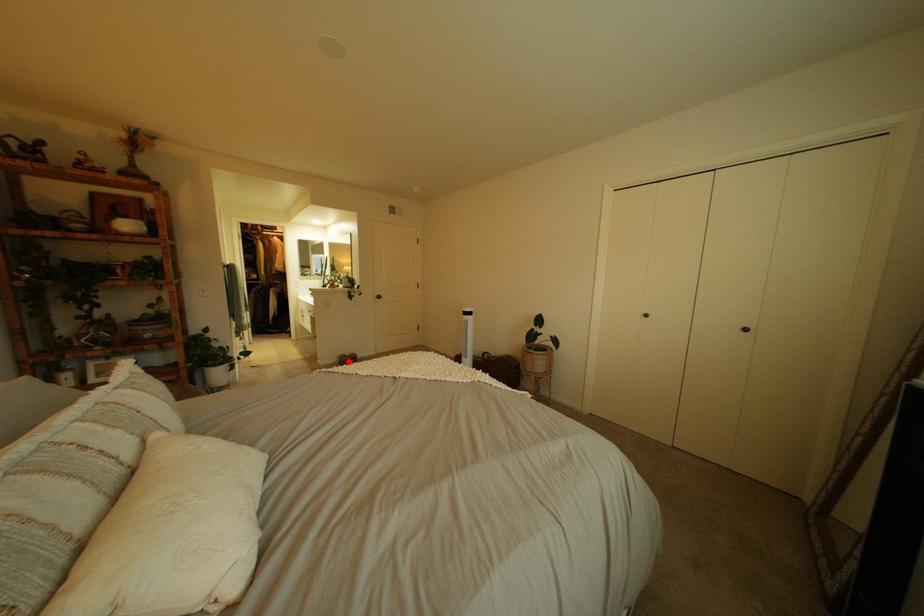
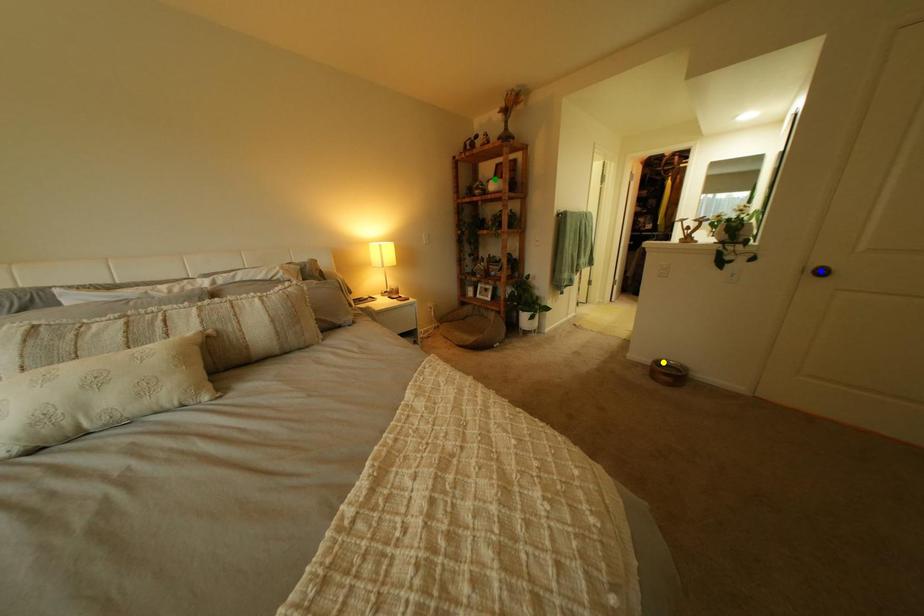
Question: I am providing you with two images of the same scene from different viewpoints. A red point is marked on the first image. You are given multiple points on the second image. Which point in image 2 represents the same 3d spot as the red point in image 1?

Choices:
 (A) green point
 (B) yellow point
 (C) blue point

Answer: (B)